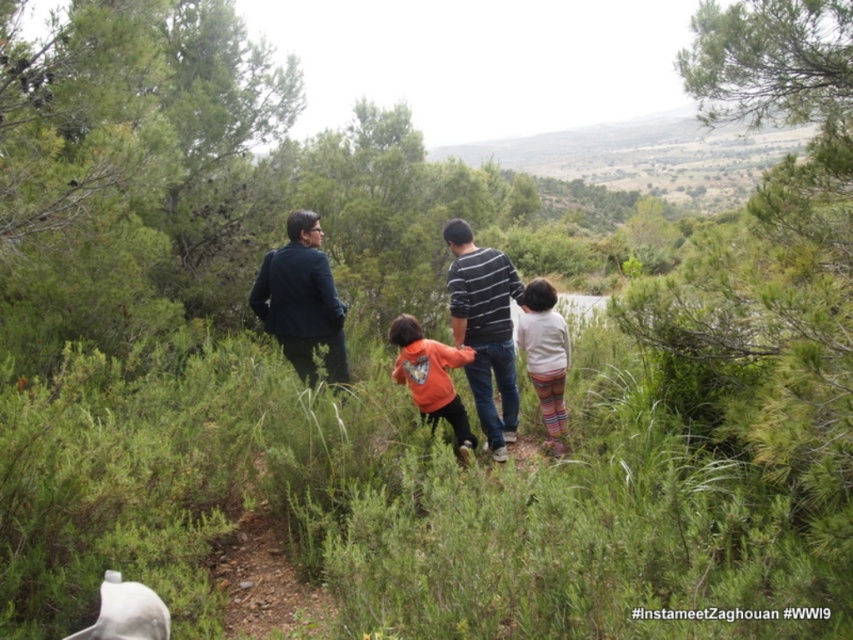
You are a photographer trying to capture a photo of the striped cotton shirt at center and the orange fleece jacket at center. Which one should you focus on first if you want to ensure both are in focus?

The striped cotton shirt at center is taller than the orange fleece jacket at center, so focusing on the striped cotton shirt at center first would ensure both are in focus since it is closer to the camera.

You are a photographer standing on the path. You want to take a photo of the striped cotton shirt at center and the dark blue suit at center. The minimum distance between the subjects in the photo should be 5 feet to ensure clarity. Can you capture them both clearly in one shot?

The distance between the striped cotton shirt at center and dark blue suit at center is 4.03 feet, which is less than the required 5 feet. Therefore, you cannot capture them both clearly in one shot with the specified minimum distance.

Based on the photo, what are the coordinates of the orange cotton shirt at center?

The orange cotton shirt at center is located at coordinates point (486, 328).